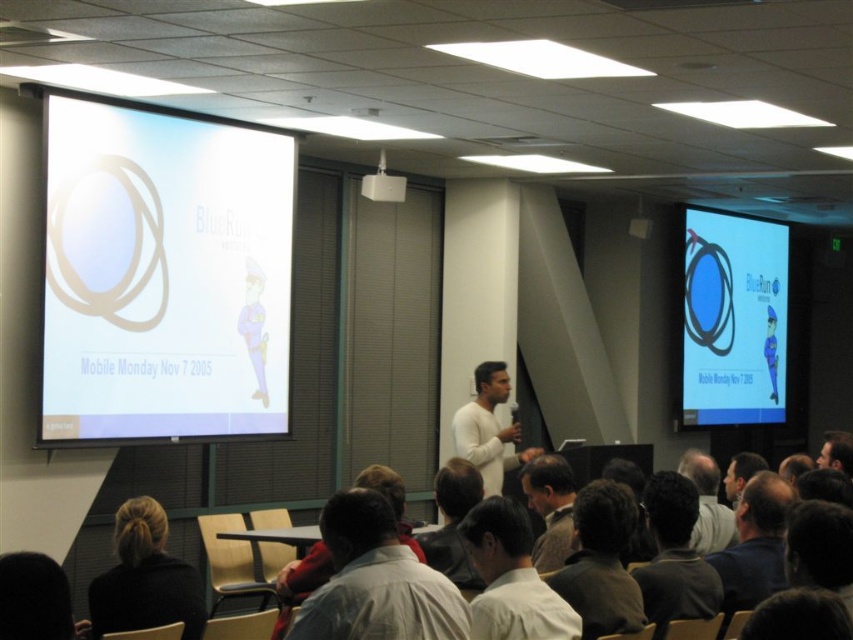
Consider the image. Is light brown shirt at center shorter than brown fabric shirt at lower right?

Indeed, light brown shirt at center has a lesser height compared to brown fabric shirt at lower right.

Is point (515, 579) positioned in front of point (608, 630)?

Yes, point (515, 579) is in front of point (608, 630).

Find the location of a particular element. The height and width of the screenshot is (640, 853). light brown shirt at center is located at coordinates (511, 579).

Consider the image. Who is positioned more to the left, brown fabric shirt at lower right or white matte shirt at center?

white matte shirt at center is more to the left.

Is brown fabric shirt at lower right bigger than white matte shirt at center?

No, brown fabric shirt at lower right is not bigger than white matte shirt at center.

Is point (627, 502) positioned before point (486, 440)?

That is True.

Find the location of a particular element. Image resolution: width=853 pixels, height=640 pixels. brown fabric shirt at lower right is located at coordinates (601, 561).

Looking at this image, does black fabric hair at lower left appear over white plastic projector at upper center?

Actually, black fabric hair at lower left is below white plastic projector at upper center.

Locate an element on the screen. The height and width of the screenshot is (640, 853). black fabric hair at lower left is located at coordinates (144, 579).

What do you see at coordinates (144, 579) in the screenshot?
I see `black fabric hair at lower left` at bounding box center [144, 579].

Identify the location of black fabric hair at lower left. (144, 579).